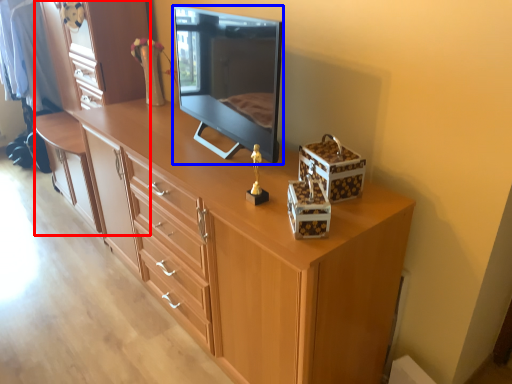
Question: Which object appears farthest to the camera in this image, dresser (highlighted by a red box) or television (highlighted by a blue box)?

Choices:
 (A) dresser
 (B) television

Answer: (A)